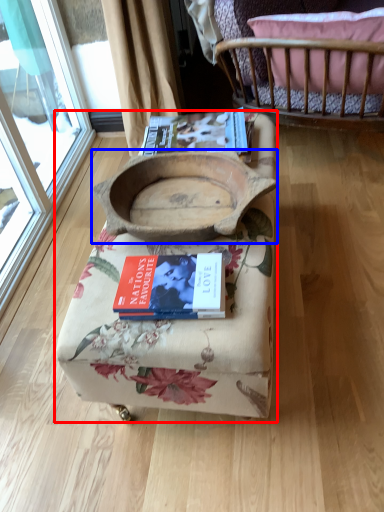
Question: Among these objects, which one is nearest to the camera, furniture (highlighted by a red box) or infant bed (highlighted by a blue box)?

Choices:
 (A) furniture
 (B) infant bed

Answer: (A)